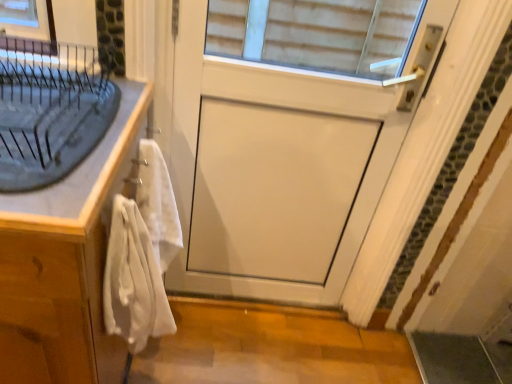
What do you see at coordinates (288, 140) in the screenshot? This screenshot has width=512, height=384. I see `white matte door at center` at bounding box center [288, 140].

What is the approximate width of white soft towel at left, the second bath towel positioned from the front?

white soft towel at left, the second bath towel positioned from the front, is 5.71 inches in width.

The width and height of the screenshot is (512, 384). Describe the element at coordinates (133, 281) in the screenshot. I see `white cotton bath towel at left, arranged as the second bath towel when viewed from the back` at that location.

I want to click on white cotton bath towel at left, arranged as the second bath towel when viewed from the back, so click(x=133, y=281).

Find the location of a particular element. white matte door at center is located at coordinates (288, 140).

Does white soft towel at left, which ranks as the 1th bath towel in back-to-front order, come in front of matte gray sink at left?

No, white soft towel at left, which ranks as the 1th bath towel in back-to-front order, is further to the viewer.

Does white soft towel at left, which ranks as the 1th bath towel in back-to-front order, have a smaller size compared to matte gray sink at left?

Indeed, white soft towel at left, which ranks as the 1th bath towel in back-to-front order, has a smaller size compared to matte gray sink at left.

Looking at this image, could you tell me if white soft towel at left, which ranks as the 1th bath towel in back-to-front order, is facing matte gray sink at left?

No.

Is the surface of white wood cabinet at left in direct contact with matte gray sink at left?

There is a gap between white wood cabinet at left and matte gray sink at left.

Does white wood cabinet at left have a greater width compared to matte gray sink at left?

Yes.

Consider the image. Considering the positions of objects white wood cabinet at left and matte gray sink at left in the image provided, who is behind, white wood cabinet at left or matte gray sink at left?

white wood cabinet at left.

Which is correct: white wood cabinet at left is inside matte gray sink at left, or outside of it?

white wood cabinet at left is outside matte gray sink at left.

From the image's perspective, between matte gray sink at left and white soft towel at left, which ranks as the 1th bath towel in back-to-front order, which one is located above?

matte gray sink at left appears higher in the image.

Is matte gray sink at left taller than white soft towel at left, which ranks as the 1th bath towel in back-to-front order?

Incorrect, the height of matte gray sink at left is not larger of that of white soft towel at left, which ranks as the 1th bath towel in back-to-front order.

Does point (24, 136) come closer to viewer compared to point (159, 218)?

Yes.

Is matte gray sink at left looking in the opposite direction of white soft towel at left, the second bath towel positioned from the front?

No, matte gray sink at left is not facing the opposite direction of white soft towel at left, the second bath towel positioned from the front.

Is white wood cabinet at left surrounded by white matte door at center?

That's incorrect, white wood cabinet at left is not inside white matte door at center.

Are white matte door at center and white wood cabinet at left beside each other?

white matte door at center and white wood cabinet at left are not in contact.

Does white matte door at center lie in front of white wood cabinet at left?

No, it is not.

Between white matte door at center and matte gray sink at left, which one has larger width?

matte gray sink at left.

Considering the sizes of objects white matte door at center and matte gray sink at left in the image provided, who is taller, white matte door at center or matte gray sink at left?

white matte door at center.

The height and width of the screenshot is (384, 512). Identify the location of cabinetry that appears below the white cotton bath towel at left, marked as the first bath towel in a front-to-back arrangement (from a real-world perspective). (66, 262).

Does white wood cabinet at left lie behind white cotton bath towel at left, marked as the first bath towel in a front-to-back arrangement?

No.

Is point (34, 363) closer or farther from the camera than point (124, 316)?

Point (34, 363) is positioned closer to the camera compared to point (124, 316).

Is white wood cabinet at left in contact with white cotton bath towel at left, marked as the first bath towel in a front-to-back arrangement?

No, white wood cabinet at left is not in contact with white cotton bath towel at left, marked as the first bath towel in a front-to-back arrangement.

Does matte gray sink at left turn towards white cotton bath towel at left, marked as the first bath towel in a front-to-back arrangement?

No, matte gray sink at left is not oriented towards white cotton bath towel at left, marked as the first bath towel in a front-to-back arrangement.

Would you consider matte gray sink at left to be distant from white cotton bath towel at left, arranged as the second bath towel when viewed from the back?

No, matte gray sink at left is not far from white cotton bath towel at left, arranged as the second bath towel when viewed from the back.

Is the depth of matte gray sink at left greater than that of white cotton bath towel at left, arranged as the second bath towel when viewed from the back?

No.

The image size is (512, 384). Find the location of `sink located above the white soft towel at left, the second bath towel positioned from the front (from a real-world perspective)`. sink located above the white soft towel at left, the second bath towel positioned from the front (from a real-world perspective) is located at coordinates (50, 109).

Locate an element on the screen. The image size is (512, 384). cabinetry on the left side of matte gray sink at left is located at coordinates (66, 262).

Looking at the image, which one is located closer to white soft towel at left, the second bath towel positioned from the front, white matte door at center or white cotton bath towel at left, arranged as the second bath towel when viewed from the back?

white cotton bath towel at left, arranged as the second bath towel when viewed from the back, lies closer to white soft towel at left, the second bath towel positioned from the front, than the other object.

Based on their spatial positions, is white matte door at center or white wood cabinet at left further from white cotton bath towel at left, marked as the first bath towel in a front-to-back arrangement?

white matte door at center is positioned further to the anchor white cotton bath towel at left, marked as the first bath towel in a front-to-back arrangement.

Estimate the real-world distances between objects in this image. Which object is closer to white wood cabinet at left, white cotton bath towel at left, arranged as the second bath towel when viewed from the back, or matte gray sink at left?

white cotton bath towel at left, arranged as the second bath towel when viewed from the back, lies closer to white wood cabinet at left than the other object.

When comparing their distances from white soft towel at left, which ranks as the 1th bath towel in back-to-front order, does white wood cabinet at left or white cotton bath towel at left, marked as the first bath towel in a front-to-back arrangement, seem closer?

Among the two, white cotton bath towel at left, marked as the first bath towel in a front-to-back arrangement, is located nearer to white soft towel at left, which ranks as the 1th bath towel in back-to-front order.

Based on their spatial positions, is white cotton bath towel at left, arranged as the second bath towel when viewed from the back, or white soft towel at left, which ranks as the 1th bath towel in back-to-front order, further from white matte door at center?

white cotton bath towel at left, arranged as the second bath towel when viewed from the back, lies further to white matte door at center than the other object.

Considering their positions, is white wood cabinet at left positioned closer to white soft towel at left, which ranks as the 1th bath towel in back-to-front order, than white matte door at center?

white wood cabinet at left.

Estimate the real-world distances between objects in this image. Which object is further from white matte door at center, white soft towel at left, the second bath towel positioned from the front, or white cotton bath towel at left, arranged as the second bath towel when viewed from the back?

The object further to white matte door at center is white cotton bath towel at left, arranged as the second bath towel when viewed from the back.

Looking at the image, which one is located further to white soft towel at left, the second bath towel positioned from the front, white matte door at center or matte gray sink at left?

white matte door at center.

At what (x,y) coordinates should I click in order to perform the action: click on bath towel between white soft towel at left, the second bath towel positioned from the front, and white matte door at center, in the horizontal direction. Please return your answer as a coordinate pair (x, y). This screenshot has width=512, height=384. Looking at the image, I should click on tap(133, 281).

The width and height of the screenshot is (512, 384). What are the coordinates of `sink situated between white wood cabinet at left and white matte door at center from left to right` in the screenshot? It's located at (50, 109).

Where is `cabinetry between matte gray sink at left and white cotton bath towel at left, marked as the first bath towel in a front-to-back arrangement, vertically`? The image size is (512, 384). cabinetry between matte gray sink at left and white cotton bath towel at left, marked as the first bath towel in a front-to-back arrangement, vertically is located at coordinates (66, 262).

The width and height of the screenshot is (512, 384). In order to click on bath towel between matte gray sink at left and white cotton bath towel at left, arranged as the second bath towel when viewed from the back, in the vertical direction in this screenshot , I will do click(157, 203).